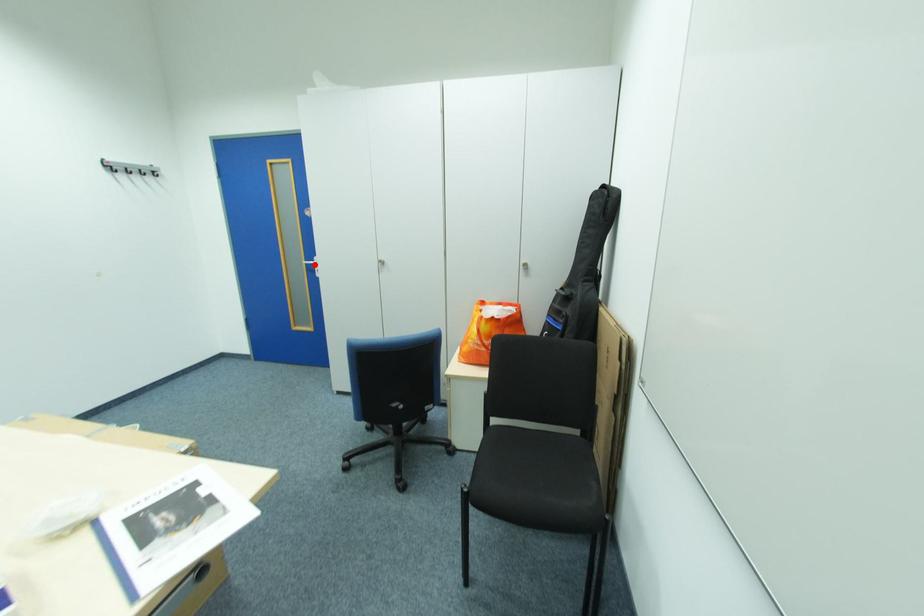
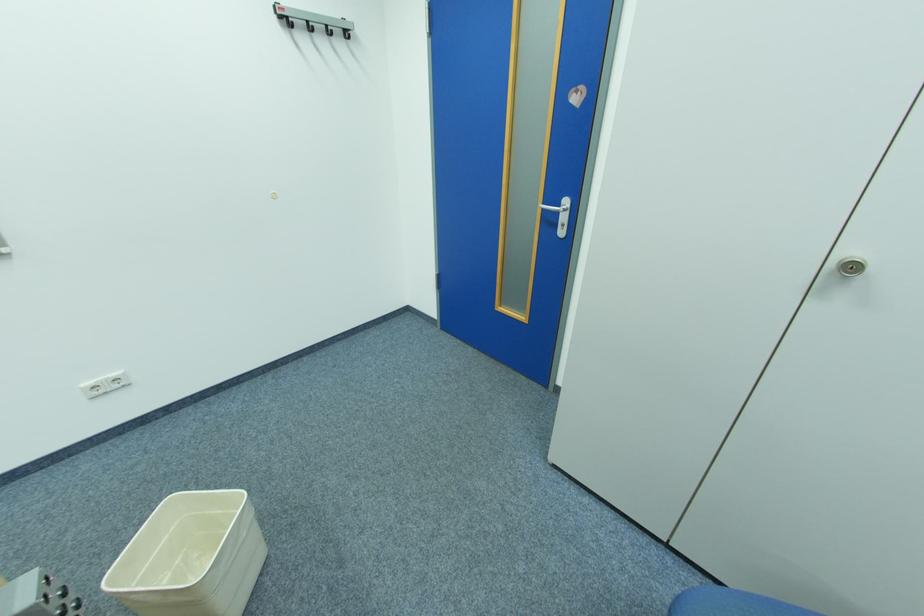
Where in the second image is the point corresponding to the highlighted location from the first image?

(552, 209)